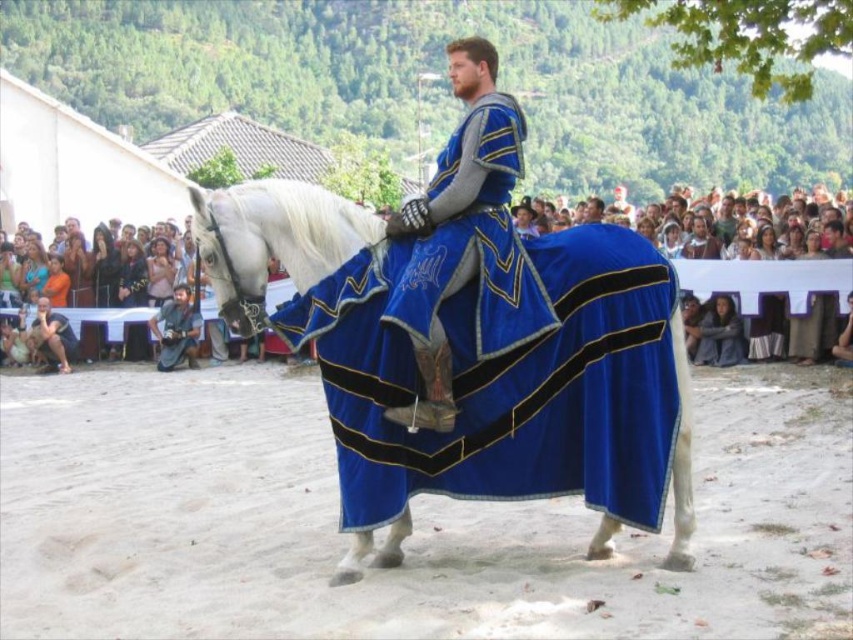
At what (x,y) coordinates should I click in order to perform the action: click on blue velvet cape at center. Please return your answer as a coordinate pair (x, y). Looking at the image, I should click on (467, 237).

Between blue velvet cape at center and smooth skin people at center, which one appears on the right side from the viewer's perspective?

blue velvet cape at center

Where is `blue velvet cape at center`? blue velvet cape at center is located at coordinates (467, 237).

Image resolution: width=853 pixels, height=640 pixels. I want to click on blue velvet cape at center, so click(x=467, y=237).

How far apart are blue velvet cape at center and blue denim jeans at lower left?

A distance of 20.69 meters exists between blue velvet cape at center and blue denim jeans at lower left.

Does blue velvet cape at center lie behind blue denim jeans at lower left?

No, it is in front of blue denim jeans at lower left.

Identify the location of blue velvet cape at center. This screenshot has height=640, width=853. (467, 237).

I want to click on blue velvet cape at center, so click(x=467, y=237).

Between point (386, 314) and point (231, 212), which one is positioned in front?

Point (386, 314)

Can you confirm if blue velvet cape at center is bigger than white glossy horse at center?

Incorrect, blue velvet cape at center is not larger than white glossy horse at center.

Is point (498, 310) less distant than point (689, 481)?

Yes, point (498, 310) is closer to viewer.

In order to click on blue velvet cape at center in this screenshot , I will do `click(467, 237)`.